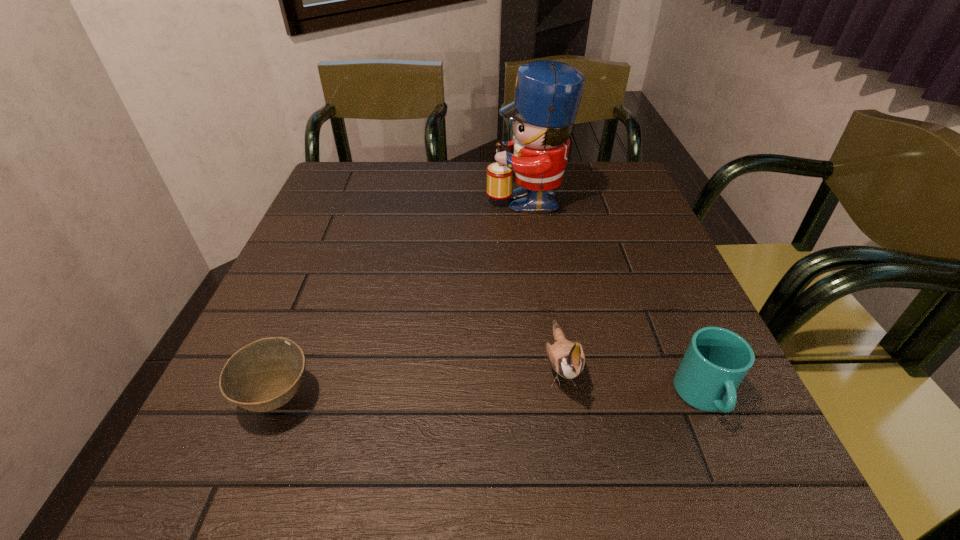
In order to click on vacant area that lies between the second tallest object and the second shortest object in this screenshot , I will do `click(632, 380)`.

Identify the location of vacant space that is in between the rightmost object and the bird. This screenshot has width=960, height=540. (632, 380).

Identify the location of vacant space in between the cup and the bird. The width and height of the screenshot is (960, 540). (632, 380).

Identify the location of vacant space that's between the cup and the bowl. The width and height of the screenshot is (960, 540). (491, 397).

Locate an element on the screen. The image size is (960, 540). free spot between the shortest object and the rightmost object is located at coordinates tap(491, 397).

Find the location of `empty space that is in between the tallest object and the shortest object`. empty space that is in between the tallest object and the shortest object is located at coordinates (401, 298).

I want to click on vacant point located between the second shortest object and the bird, so click(632, 380).

At what (x,y) coordinates should I click in order to perform the action: click on vacant space in between the third shortest object and the cup. Please return your answer as a coordinate pair (x, y). This screenshot has height=540, width=960. Looking at the image, I should click on (632, 380).

Find the location of a particular element. Image resolution: width=960 pixels, height=540 pixels. free area in between the second tallest object and the farthest object is located at coordinates (542, 280).

In order to click on vacant area that lies between the bowl and the bird in this screenshot , I will do `click(420, 380)`.